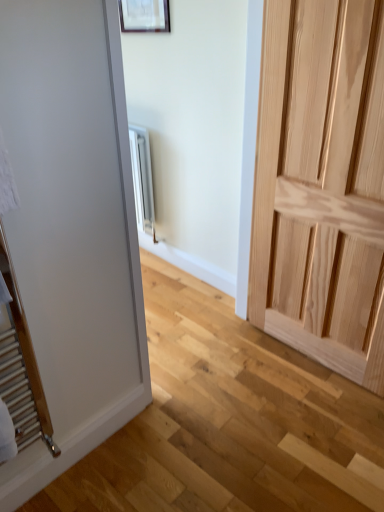
The image size is (384, 512). Identify the location of vacant space that is to the left of natural wood door at right. (238, 376).